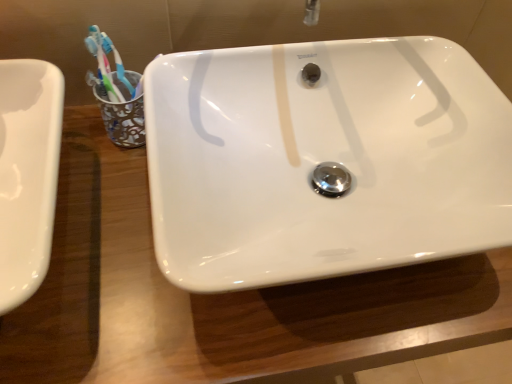
What do you see at coordinates (323, 160) in the screenshot?
I see `white glossy sink at center` at bounding box center [323, 160].

Measure the distance between point (185,130) and camera.

Point (185,130) is 24.96 inches away from camera.

The width and height of the screenshot is (512, 384). I want to click on white glossy sink at center, so click(323, 160).

The image size is (512, 384). Identify the location of white glossy sink at center. (323, 160).